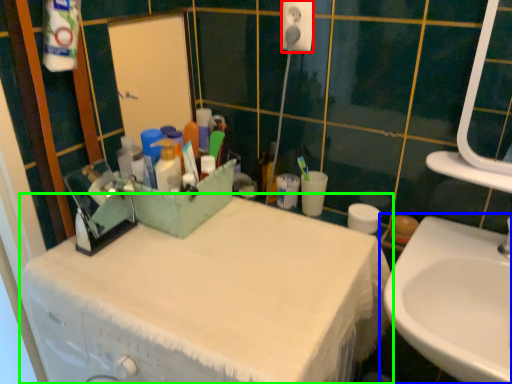
Question: Which is farther away from electric outlet (highlighted by a red box)? sink (highlighted by a blue box) or bathroom cabinet (highlighted by a green box)?

Choices:
 (A) sink
 (B) bathroom cabinet

Answer: (A)